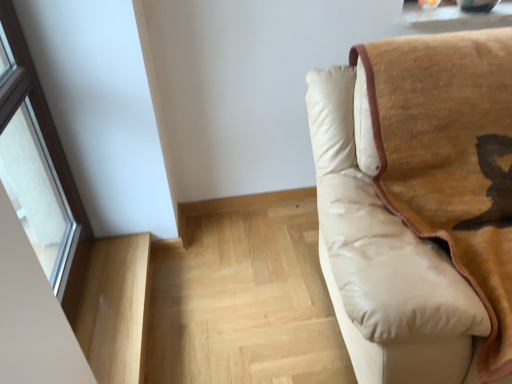
Find the location of a particular element. The width and height of the screenshot is (512, 384). beige leather couch at right is located at coordinates (418, 204).

What is the approximate width of beige leather couch at right?

The width of beige leather couch at right is 1.03 meters.

What do you see at coordinates (40, 170) in the screenshot?
I see `transparent glass window at left` at bounding box center [40, 170].

Locate an element on the screen. This screenshot has height=384, width=512. beige leather couch at right is located at coordinates (418, 204).

From a real-world perspective, is light wood stairwell at lower left, the 2th stairwell viewed from the right, under beige leather couch at right?

Yes, from a real-world perspective, light wood stairwell at lower left, the 2th stairwell viewed from the right, is below beige leather couch at right.

Looking at this image, is beige leather couch at right at the back of light wood stairwell at lower left, the 2th stairwell viewed from the right?

light wood stairwell at lower left, the 2th stairwell viewed from the right, is not turned away from beige leather couch at right.

Can you confirm if light wood stairwell at lower left, acting as the first stairwell starting from the left, is shorter than beige leather couch at right?

Correct, light wood stairwell at lower left, acting as the first stairwell starting from the left, is not as tall as beige leather couch at right.

Is light wood stairwell at lower left, the 2th stairwell viewed from the right, in front of or behind beige leather couch at right in the image?

Clearly, light wood stairwell at lower left, the 2th stairwell viewed from the right, is behind beige leather couch at right.

Considering the positions of point (105, 248) and point (61, 275), is point (105, 248) closer or farther from the camera than point (61, 275)?

Clearly, point (105, 248) is more distant from the camera than point (61, 275).

Are light wood stairwell at lower left, the 2th stairwell viewed from the right, and transparent glass window at left beside each other?

No, light wood stairwell at lower left, the 2th stairwell viewed from the right, is not next to transparent glass window at left.

Is transparent glass window at left completely or partially inside light wood stairwell at lower left, acting as the first stairwell starting from the left?

Definitely not — transparent glass window at left is not inside light wood stairwell at lower left, acting as the first stairwell starting from the left.

Is light wood stairwell at lower left, acting as the first stairwell starting from the left, positioned behind transparent glass window at left?

That is True.

From a real-world perspective, is beige leather couch at right located higher than transparent glass window at left?

Incorrect, from a real-world perspective, beige leather couch at right is lower than transparent glass window at left.

In the image, is beige leather couch at right positioned in front of or behind transparent glass window at left?

beige leather couch at right is positioned closer to the viewer than transparent glass window at left.

Is beige leather couch at right completely or partially inside transparent glass window at left?

No, beige leather couch at right is located outside of transparent glass window at left.

Who is smaller, transparent glass window at left or beige leather couch at right?

Smaller between the two is transparent glass window at left.

Are light wood stairwell at lower left, the 1th stairwell positioned from the right, and light wood stairwell at lower left, the 2th stairwell viewed from the right, far apart?

No, light wood stairwell at lower left, the 1th stairwell positioned from the right, is not far away from light wood stairwell at lower left, the 2th stairwell viewed from the right.

Looking at their sizes, would you say light wood stairwell at lower left, which ranks as the 2th stairwell in left-to-right order, is wider or thinner than light wood stairwell at lower left, the 2th stairwell viewed from the right?

Clearly, light wood stairwell at lower left, which ranks as the 2th stairwell in left-to-right order, has more width compared to light wood stairwell at lower left, the 2th stairwell viewed from the right.

Is light wood stairwell at lower left, which ranks as the 2th stairwell in left-to-right order, shorter than light wood stairwell at lower left, the 2th stairwell viewed from the right?

Indeed, light wood stairwell at lower left, which ranks as the 2th stairwell in left-to-right order, has a lesser height compared to light wood stairwell at lower left, the 2th stairwell viewed from the right.

How much distance is there between light wood stairwell at lower left, the 1th stairwell positioned from the right, and light wood stairwell at lower left, the 2th stairwell viewed from the right?

The distance of light wood stairwell at lower left, the 1th stairwell positioned from the right, from light wood stairwell at lower left, the 2th stairwell viewed from the right, is 12.72 inches.

Considering the sizes of objects light wood stairwell at lower left, which ranks as the 2th stairwell in left-to-right order, and transparent glass window at left in the image provided, who is taller, light wood stairwell at lower left, which ranks as the 2th stairwell in left-to-right order, or transparent glass window at left?

Standing taller between the two is transparent glass window at left.

Is light wood stairwell at lower left, which ranks as the 2th stairwell in left-to-right order, completely or partially outside of transparent glass window at left?

Yes, light wood stairwell at lower left, which ranks as the 2th stairwell in left-to-right order, is located beyond the bounds of transparent glass window at left.

Between light wood stairwell at lower left, the 1th stairwell positioned from the right, and transparent glass window at left, which one has smaller width?

transparent glass window at left.

Which is more to the right, light wood stairwell at lower left, the 1th stairwell positioned from the right, or transparent glass window at left?

light wood stairwell at lower left, the 1th stairwell positioned from the right, is more to the right.

How far apart are transparent glass window at left and light wood stairwell at lower left, the 2th stairwell viewed from the right?

They are 10.92 inches apart.

From a real-world perspective, between transparent glass window at left and light wood stairwell at lower left, acting as the first stairwell starting from the left, who is vertically lower?

light wood stairwell at lower left, acting as the first stairwell starting from the left, from a real-world perspective.

Which of these two, transparent glass window at left or light wood stairwell at lower left, the 2th stairwell viewed from the right, is bigger?

With larger size is transparent glass window at left.

Does transparent glass window at left appear on the left side of light wood stairwell at lower left, acting as the first stairwell starting from the left?

Indeed, transparent glass window at left is positioned on the left side of light wood stairwell at lower left, acting as the first stairwell starting from the left.

Image resolution: width=512 pixels, height=384 pixels. I want to click on studio couch above the light wood stairwell at lower left, the 2th stairwell viewed from the right (from the image's perspective), so click(418, 204).

This screenshot has height=384, width=512. What are the coordinates of `window that is on the left side of light wood stairwell at lower left, acting as the first stairwell starting from the left` in the screenshot? It's located at (40, 170).

Considering their positions, is light wood stairwell at lower left, the 2th stairwell viewed from the right, positioned closer to beige leather couch at right than light wood stairwell at lower left, which ranks as the 2th stairwell in left-to-right order?

light wood stairwell at lower left, which ranks as the 2th stairwell in left-to-right order, is closer to beige leather couch at right.

From the image, which object appears to be nearer to transparent glass window at left, light wood stairwell at lower left, the 2th stairwell viewed from the right, or beige leather couch at right?

light wood stairwell at lower left, the 2th stairwell viewed from the right, lies closer to transparent glass window at left than the other object.

From the image, which object appears to be nearer to beige leather couch at right, light wood stairwell at lower left, the 2th stairwell viewed from the right, or transparent glass window at left?

The object closer to beige leather couch at right is light wood stairwell at lower left, the 2th stairwell viewed from the right.

Which object lies nearer to the anchor point light wood stairwell at lower left, acting as the first stairwell starting from the left, transparent glass window at left or light wood stairwell at lower left, which ranks as the 2th stairwell in left-to-right order?

transparent glass window at left.

Based on their spatial positions, is beige leather couch at right or transparent glass window at left further from light wood stairwell at lower left, acting as the first stairwell starting from the left?

The object further to light wood stairwell at lower left, acting as the first stairwell starting from the left, is beige leather couch at right.

Estimate the real-world distances between objects in this image. Which object is further from beige leather couch at right, transparent glass window at left or light wood stairwell at lower left, the 2th stairwell viewed from the right?

transparent glass window at left lies further to beige leather couch at right than the other object.

Looking at the image, which one is located closer to beige leather couch at right, light wood stairwell at lower left, the 1th stairwell positioned from the right, or transparent glass window at left?

light wood stairwell at lower left, the 1th stairwell positioned from the right.

Based on their spatial positions, is transparent glass window at left or beige leather couch at right further from light wood stairwell at lower left, the 2th stairwell viewed from the right?

beige leather couch at right is further to light wood stairwell at lower left, the 2th stairwell viewed from the right.

Locate an element on the screen. This screenshot has height=384, width=512. stairwell between transparent glass window at left and light wood stairwell at lower left, the 1th stairwell positioned from the right, along the z-axis is located at coordinates (115, 308).

Image resolution: width=512 pixels, height=384 pixels. Find the location of `stairwell between light wood stairwell at lower left, acting as the first stairwell starting from the left, and beige leather couch at right`. stairwell between light wood stairwell at lower left, acting as the first stairwell starting from the left, and beige leather couch at right is located at coordinates (244, 296).